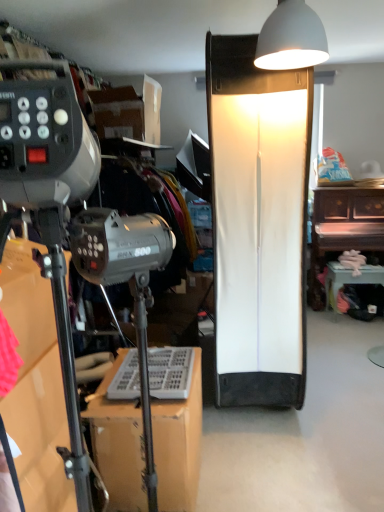
Describe the element at coordinates (350, 278) in the screenshot. I see `white glossy table at lower right, placed as the 2th furniture when sorted from front to back` at that location.

Where is `white matte lampshade at upper center, the second lamp when ordered from back to front`? white matte lampshade at upper center, the second lamp when ordered from back to front is located at coordinates (291, 38).

Would you say metallic silver tripod at lower left, which is the 3th furniture from back to front, is to the left or to the right of white matte lampshade at upper center, the second lamp when ordered from back to front, in the picture?

metallic silver tripod at lower left, which is the 3th furniture from back to front, is positioned on white matte lampshade at upper center, the second lamp when ordered from back to front,'s left side.

Based on the photo, which of these two, metallic silver tripod at lower left, marked as the first furniture in a front-to-back arrangement, or white matte lampshade at upper center, acting as the 1th lamp starting from the top, stands taller?

metallic silver tripod at lower left, marked as the first furniture in a front-to-back arrangement.

Which object is closer to the camera taking this photo, metallic silver tripod at lower left, the 1th furniture in the left-to-right sequence, or white matte lampshade at upper center, the second lamp in the bottom-to-top sequence?

metallic silver tripod at lower left, the 1th furniture in the left-to-right sequence.

Which of these two, metallic silver tripod at lower left, the 1th furniture in the left-to-right sequence, or white matte lampshade at upper center, placed as the first lamp when sorted from front to back, is bigger?

With larger size is metallic silver tripod at lower left, the 1th furniture in the left-to-right sequence.

Locate an element on the screen. Image resolution: width=384 pixels, height=512 pixels. lamp behind the white matte lampshade at upper center, the second lamp in the bottom-to-top sequence is located at coordinates (258, 223).

From a real-world perspective, is white matte lampshade at upper center, acting as the 1th lamp starting from the top, positioned above or below white matte lampshade at center, which is counted as the first lamp, starting from the back?

Clearly, from a real-world perspective, white matte lampshade at upper center, acting as the 1th lamp starting from the top, is above white matte lampshade at center, which is counted as the first lamp, starting from the back.

Considering the relative sizes of white matte lampshade at upper center, acting as the 1th lamp starting from the top, and white matte lampshade at center, which is counted as the first lamp, starting from the back, in the image provided, is white matte lampshade at upper center, acting as the 1th lamp starting from the top, taller than white matte lampshade at center, which is counted as the first lamp, starting from the back,?

In fact, white matte lampshade at upper center, acting as the 1th lamp starting from the top, may be shorter than white matte lampshade at center, which is counted as the first lamp, starting from the back.

Considering the relative sizes of white matte lampshade at upper center, the second lamp when ordered from back to front, and white matte lampshade at center, positioned as the 1th lamp in bottom-to-top order, in the image provided, is white matte lampshade at upper center, the second lamp when ordered from back to front, wider than white matte lampshade at center, positioned as the 1th lamp in bottom-to-top order,?

No, white matte lampshade at upper center, the second lamp when ordered from back to front, is not wider than white matte lampshade at center, positioned as the 1th lamp in bottom-to-top order.

From the image's perspective, is white matte lampshade at center, which is the second lamp from top to bottom, located above white matte lampshade at upper center, placed as the first lamp when sorted from front to back?

No.

How far apart are white matte lampshade at center, which is the second lamp from top to bottom, and white matte lampshade at upper center, the second lamp when ordered from back to front?

white matte lampshade at center, which is the second lamp from top to bottom, and white matte lampshade at upper center, the second lamp when ordered from back to front, are 26.33 inches apart from each other.

Is white matte lampshade at upper center, the second lamp in the bottom-to-top sequence, at the back of white matte lampshade at center, which is the second lamp from top to bottom?

No, white matte lampshade at center, which is the second lamp from top to bottom, is not facing the opposite direction of white matte lampshade at upper center, the second lamp in the bottom-to-top sequence.

Considering the relative positions of white matte lampshade at center, which is counted as the second lamp, starting from the front, and white matte lampshade at upper center, acting as the 1th lamp starting from the top, in the image provided, is white matte lampshade at center, which is counted as the second lamp, starting from the front, to the right of white matte lampshade at upper center, acting as the 1th lamp starting from the top, from the viewer's perspective?

Yes, white matte lampshade at center, which is counted as the second lamp, starting from the front, is to the right of white matte lampshade at upper center, acting as the 1th lamp starting from the top.

How different are the orientations of white matte lampshade at center, which is the second lamp from top to bottom, and metallic silver tripod at lower left, marked as the first furniture in a front-to-back arrangement, in degrees?

They differ by 90.5 degrees in their facing directions.

Between point (304, 258) and point (133, 429), which one is positioned behind?

The point (304, 258) is more distant.

From a real-world perspective, is white matte lampshade at center, which is the second lamp from top to bottom, physically above metallic silver tripod at lower left, marked as the third furniture in a right-to-left arrangement?

Yes, from a real-world perspective, white matte lampshade at center, which is the second lamp from top to bottom, is over metallic silver tripod at lower left, marked as the third furniture in a right-to-left arrangement

Between white matte lampshade at center, positioned as the 1th lamp in bottom-to-top order, and metallic silver tripod at lower left, marked as the third furniture in a right-to-left arrangement, which one appears on the right side from the viewer's perspective?

white matte lampshade at center, positioned as the 1th lamp in bottom-to-top order, is more to the right.

Looking at the image, does white matte lampshade at upper center, acting as the 1th lamp starting from the top, seem bigger or smaller compared to metallic silver tripod at lower left, which is the 3th furniture from back to front?

In the image, white matte lampshade at upper center, acting as the 1th lamp starting from the top, appears to be smaller than metallic silver tripod at lower left, which is the 3th furniture from back to front.

From the image's perspective, is white matte lampshade at upper center, the second lamp when ordered from back to front, above or below metallic silver tripod at lower left, which is the 3th furniture from back to front?

white matte lampshade at upper center, the second lamp when ordered from back to front, is situated higher than metallic silver tripod at lower left, which is the 3th furniture from back to front, in the image.

Is point (274, 38) farther from viewer compared to point (196, 369)?

No, it is in front of (196, 369).

Is white matte lampshade at upper center, the second lamp when ordered from back to front, with metallic silver tripod at lower left, marked as the third furniture in a right-to-left arrangement?

They are not placed beside each other.

Looking at this image, between metallic silver tripod at lower left, marked as the third furniture in a right-to-left arrangement, and white glossy table at lower right, the second furniture in the back-to-front sequence, which one is positioned in front?

Positioned in front is metallic silver tripod at lower left, marked as the third furniture in a right-to-left arrangement.

Can you see metallic silver tripod at lower left, the 1th furniture in the left-to-right sequence, touching white glossy table at lower right, placed as the 2th furniture when sorted from front to back?

No, metallic silver tripod at lower left, the 1th furniture in the left-to-right sequence, is not in contact with white glossy table at lower right, placed as the 2th furniture when sorted from front to back.

Find the location of `furniture on the left of the white glossy table at lower right, the second furniture in the back-to-front sequence`. furniture on the left of the white glossy table at lower right, the second furniture in the back-to-front sequence is located at coordinates (118, 445).

Is metallic silver tripod at lower left, marked as the third furniture in a right-to-left arrangement, aimed at wooden piano at right, the first furniture in the right-to-left sequence?

No, metallic silver tripod at lower left, marked as the third furniture in a right-to-left arrangement, is not aimed at wooden piano at right, the first furniture in the right-to-left sequence.

Looking at this image, between metallic silver tripod at lower left, which is the 3th furniture from back to front, and wooden piano at right, placed as the third furniture when sorted from left to right, which one has larger width?

With larger width is wooden piano at right, placed as the third furniture when sorted from left to right.

Is metallic silver tripod at lower left, marked as the first furniture in a front-to-back arrangement, not within wooden piano at right, the first furniture in the right-to-left sequence?

Yes, metallic silver tripod at lower left, marked as the first furniture in a front-to-back arrangement, is outside of wooden piano at right, the first furniture in the right-to-left sequence.

From the metallic silver tripod at lower left, which is the 3th furniture from back to front, count 1st lamp to the right and point to it. Please provide its 2D coordinates.

[(291, 38)]

Locate an element on the screen. lamp that appears above the white matte lampshade at center, which is counted as the first lamp, starting from the back (from the image's perspective) is located at coordinates (291, 38).

Considering their positions, is white glossy table at lower right, the second furniture in the right-to-left sequence, positioned closer to metallic silver tripod at lower left, marked as the first furniture in a front-to-back arrangement, than white matte lampshade at center, positioned as the 1th lamp in bottom-to-top order?

white matte lampshade at center, positioned as the 1th lamp in bottom-to-top order, is positioned closer to the anchor metallic silver tripod at lower left, marked as the first furniture in a front-to-back arrangement.

Based on their spatial positions, is white glossy table at lower right, the second furniture in the back-to-front sequence, or wooden piano at right, the first furniture in the right-to-left sequence, further from white matte lampshade at upper center, placed as the first lamp when sorted from front to back?

Among the two, white glossy table at lower right, the second furniture in the back-to-front sequence, is located further to white matte lampshade at upper center, placed as the first lamp when sorted from front to back.

Which object lies further to the anchor point white matte lampshade at upper center, the second lamp in the bottom-to-top sequence, wooden piano at right, the first furniture in the right-to-left sequence, or white glossy table at lower right, placed as the 2th furniture when sorted from front to back?

white glossy table at lower right, placed as the 2th furniture when sorted from front to back, is positioned further to the anchor white matte lampshade at upper center, the second lamp in the bottom-to-top sequence.

Looking at the image, which one is located closer to white glossy table at lower right, placed as the 2th furniture when sorted from front to back, metallic silver tripod at lower left, which is the 3th furniture from back to front, or wooden piano at right, the first furniture in the right-to-left sequence?

Among the two, wooden piano at right, the first furniture in the right-to-left sequence, is located nearer to white glossy table at lower right, placed as the 2th furniture when sorted from front to back.

From the image, which object appears to be farther from wooden piano at right, placed as the third furniture when sorted from left to right, white matte lampshade at center, which is the second lamp from top to bottom, or white glossy table at lower right, the second furniture in the back-to-front sequence?

Based on the image, white matte lampshade at center, which is the second lamp from top to bottom, appears to be further to wooden piano at right, placed as the third furniture when sorted from left to right.

Based on their spatial positions, is white matte lampshade at upper center, acting as the 1th lamp starting from the top, or white matte lampshade at center, which is counted as the second lamp, starting from the front, closer to metallic silver tripod at lower left, marked as the third furniture in a right-to-left arrangement?

The object closer to metallic silver tripod at lower left, marked as the third furniture in a right-to-left arrangement, is white matte lampshade at center, which is counted as the second lamp, starting from the front.

Looking at the image, which one is located closer to white glossy table at lower right, placed as the 2th furniture when sorted from front to back, white matte lampshade at upper center, placed as the first lamp when sorted from front to back, or metallic silver tripod at lower left, which is the 3th furniture from back to front?

Among the two, metallic silver tripod at lower left, which is the 3th furniture from back to front, is located nearer to white glossy table at lower right, placed as the 2th furniture when sorted from front to back.

Which object lies nearer to the anchor point white matte lampshade at upper center, the second lamp in the bottom-to-top sequence, metallic silver tripod at lower left, which is the 3th furniture from back to front, or wooden piano at right, the first furniture in the right-to-left sequence?

metallic silver tripod at lower left, which is the 3th furniture from back to front, lies closer to white matte lampshade at upper center, the second lamp in the bottom-to-top sequence, than the other object.

Find the location of a particular element. furniture between white matte lampshade at center, which is counted as the first lamp, starting from the back, and wooden piano at right, the first furniture in the back-to-front sequence, along the z-axis is located at coordinates (350, 278).

At what (x,y) coordinates should I click in order to perform the action: click on lamp located between white matte lampshade at upper center, the second lamp in the bottom-to-top sequence, and white glossy table at lower right, which is the second furniture from left to right, in the depth direction. Please return your answer as a coordinate pair (x, y). The width and height of the screenshot is (384, 512). Looking at the image, I should click on (258, 223).

Identify the location of lamp positioned between white matte lampshade at upper center, the second lamp in the bottom-to-top sequence, and wooden piano at right, the first furniture in the right-to-left sequence, from near to far. [x=258, y=223].

This screenshot has height=512, width=384. What are the coordinates of `furniture located between metallic silver tripod at lower left, marked as the first furniture in a front-to-back arrangement, and wooden piano at right, the first furniture in the right-to-left sequence, in the depth direction` in the screenshot? It's located at (350, 278).